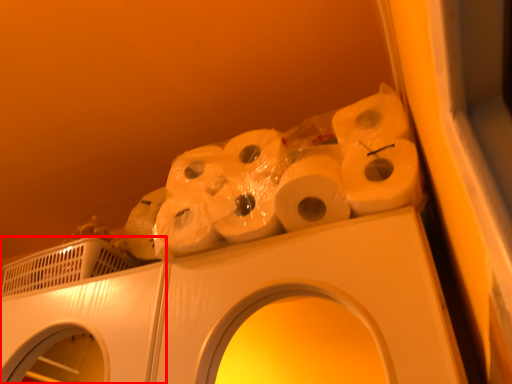
Question: From the image's perspective, where is washing machine (annotated by the red box) located in relation to toilet paper in the image?

Choices:
 (A) below
 (B) above

Answer: (A)